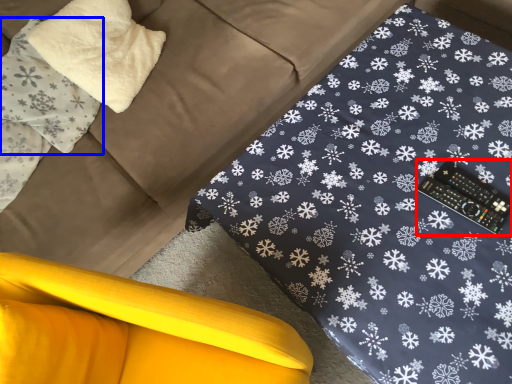
Question: Which object is further to the camera taking this photo, control (highlighted by a red box) or pillow (highlighted by a blue box)?

Choices:
 (A) control
 (B) pillow

Answer: (B)